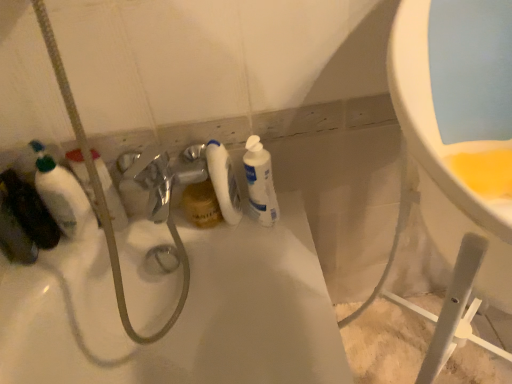
Question: Looking at the image, does white glossy bottle at center, which ranks as the second cleaning product in left-to-right order, seem bigger or smaller compared to white matte bottle at center, the 2th cleaning product from the right?

Choices:
 (A) big
 (B) small

Answer: (A)

Question: In terms of height, does white glossy bottle at center, which appears as the 1th cleaning product when viewed from the right, look taller or shorter compared to white matte bottle at center, the first cleaning product when ordered from left to right?

Choices:
 (A) short
 (B) tall

Answer: (A)

Question: Does point (249, 192) appear closer or farther from the camera than point (236, 213)?

Choices:
 (A) farther
 (B) closer

Answer: (B)

Question: Considering the positions of white matte bottle at center, the first cleaning product when ordered from left to right, and white glossy bottle at center, which ranks as the second cleaning product in left-to-right order, in the image, is white matte bottle at center, the first cleaning product when ordered from left to right, taller or shorter than white glossy bottle at center, which ranks as the second cleaning product in left-to-right order,?

Choices:
 (A) short
 (B) tall

Answer: (B)

Question: From the image's perspective, is white matte bottle at center, the first cleaning product when ordered from left to right, positioned above or below white glossy bottle at center, which ranks as the second cleaning product in left-to-right order?

Choices:
 (A) below
 (B) above

Answer: (B)

Question: In the image, is white matte bottle at center, the 2th cleaning product from the right, positioned in front of or behind white glossy bottle at center, which ranks as the second cleaning product in left-to-right order?

Choices:
 (A) front
 (B) behind

Answer: (B)

Question: Is point (224, 206) closer or farther from the camera than point (266, 213)?

Choices:
 (A) farther
 (B) closer

Answer: (B)